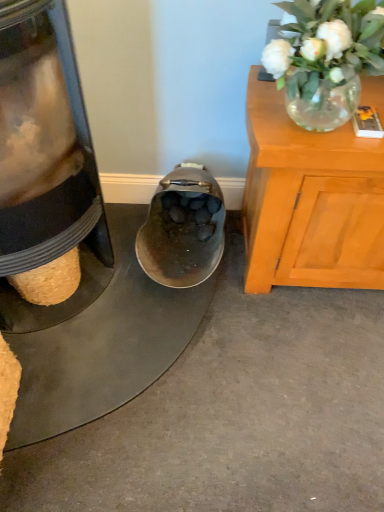
You are a GUI agent. You are given a task and a screenshot of the screen. Output one action in this format:
    pyautogui.click(x=<x>, y=<y>)
    Task: Click on the free region on the left part of shiny metallic shoe at center
    The width and height of the screenshot is (384, 512).
    Given the screenshot: What is the action you would take?
    pyautogui.click(x=113, y=264)